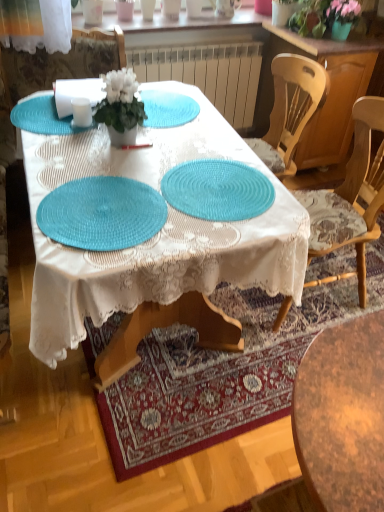
Question: Considering the relative sizes of matte white chair at upper left, the second chair in the right-to-left sequence, and teal woven placemat at center, positioned as the 3th glass plate in top-to-bottom order, in the image provided, is matte white chair at upper left, the second chair in the right-to-left sequence, wider than teal woven placemat at center, positioned as the 3th glass plate in top-to-bottom order,?

Choices:
 (A) yes
 (B) no

Answer: (A)

Question: Does matte white chair at upper left, placed as the 1th chair when sorted from left to right, appear on the right side of teal woven placemat at center, positioned as the 3th glass plate in top-to-bottom order?

Choices:
 (A) yes
 (B) no

Answer: (B)

Question: Is matte white chair at upper left, placed as the 1th chair when sorted from left to right, far away from teal woven placemat at center, the 1th glass plate ordered from the bottom?

Choices:
 (A) no
 (B) yes

Answer: (B)

Question: Is matte white chair at upper left, placed as the 1th chair when sorted from left to right, bigger than teal woven placemat at center, positioned as the 3th glass plate in top-to-bottom order?

Choices:
 (A) no
 (B) yes

Answer: (B)

Question: Is matte white chair at upper left, placed as the 1th chair when sorted from left to right, not within teal woven placemat at center, the 1th glass plate ordered from the bottom?

Choices:
 (A) no
 (B) yes

Answer: (B)

Question: From the image's perspective, is wooden cabinet at right located above or below teal woven placemat at center, the second glass plate positioned from the bottom?

Choices:
 (A) above
 (B) below

Answer: (A)

Question: From a real-world perspective, is wooden cabinet at right positioned above or below teal woven placemat at center, the second glass plate positioned from the bottom?

Choices:
 (A) below
 (B) above

Answer: (A)

Question: In the image, is wooden cabinet at right on the left side or the right side of teal woven placemat at center, which ranks as the second glass plate in top-to-bottom order?

Choices:
 (A) right
 (B) left

Answer: (A)

Question: Relative to teal woven placemat at center, which ranks as the second glass plate in top-to-bottom order, is wooden cabinet at right in front or behind?

Choices:
 (A) front
 (B) behind

Answer: (B)

Question: Based on their sizes in the image, would you say wooden cabinet at right is bigger or smaller than matte white chair at upper left, placed as the 1th chair when sorted from left to right?

Choices:
 (A) big
 (B) small

Answer: (B)

Question: Is wooden cabinet at right spatially inside matte white chair at upper left, placed as the 1th chair when sorted from left to right, or outside of it?

Choices:
 (A) outside
 (B) inside

Answer: (A)

Question: Is wooden cabinet at right taller or shorter than matte white chair at upper left, the second chair in the right-to-left sequence?

Choices:
 (A) short
 (B) tall

Answer: (A)

Question: From a real-world perspective, is wooden cabinet at right above or below matte white chair at upper left, placed as the 1th chair when sorted from left to right?

Choices:
 (A) below
 (B) above

Answer: (B)

Question: In terms of height, does green leafy plant at upper right look taller or shorter compared to teal woven placemat at center, the 1th glass plate ordered from the bottom?

Choices:
 (A) short
 (B) tall

Answer: (B)

Question: Is green leafy plant at upper right wider or thinner than teal woven placemat at center, the 1th glass plate ordered from the bottom?

Choices:
 (A) thin
 (B) wide

Answer: (A)